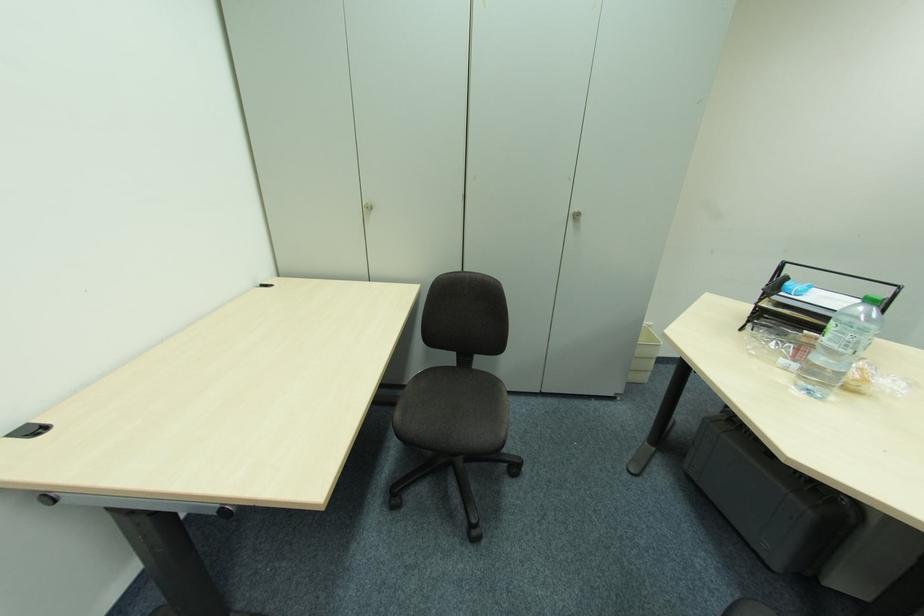
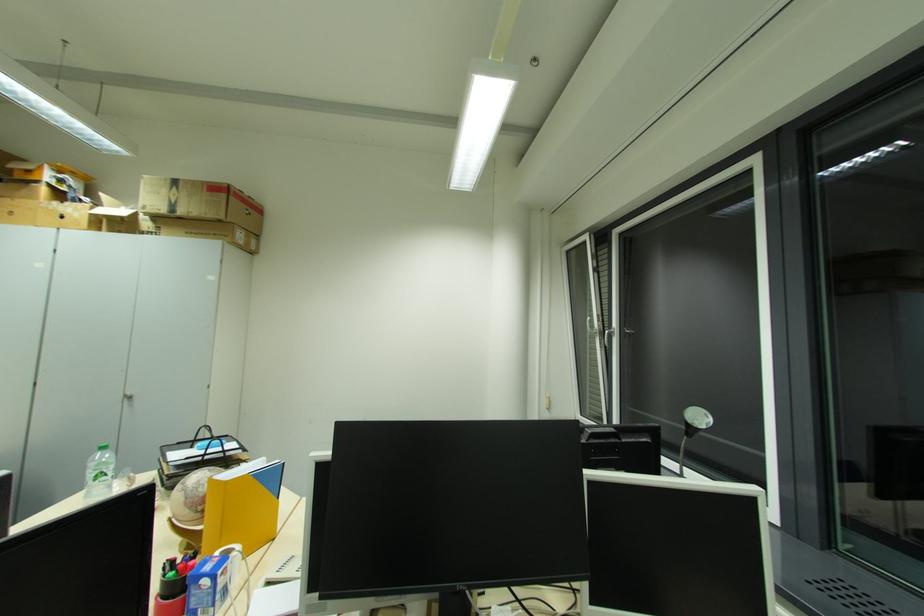
In the second image, find the point that corresponds to point 574,219 in the first image.

(128, 400)